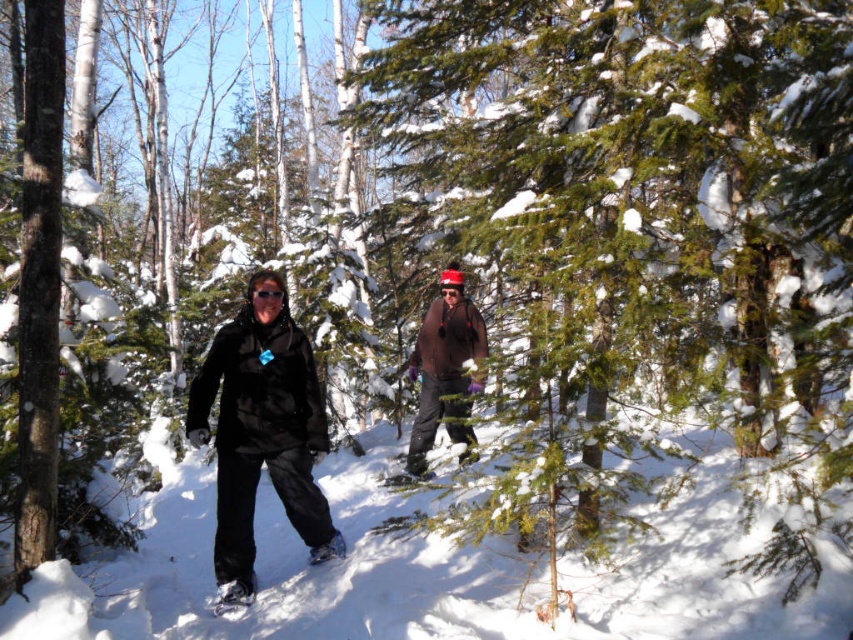
Question: Is black matte snowshoes at center smaller than brown matte jacket at center?

Choices:
 (A) yes
 (B) no

Answer: (A)

Question: Does black matte snowshoes at center have a smaller size compared to white rubber snowshoe at lower left?

Choices:
 (A) no
 (B) yes

Answer: (A)

Question: Which object is closer to the camera taking this photo?

Choices:
 (A) black matte snowshoes at center
 (B) white rubber snowshoe at lower left
 (C) black rubber snowshoe at lower center
 (D) brown matte jacket at center

Answer: (D)

Question: Is black matte snowshoes at center positioned at the back of brown matte jacket at center?

Choices:
 (A) no
 (B) yes

Answer: (B)

Question: Among these objects, which one is nearest to the camera?

Choices:
 (A) white rubber snowshoe at lower left
 (B) black matte snowshoes at center

Answer: (A)

Question: Which point appears farthest from the camera in this image?

Choices:
 (A) (444, 352)
 (B) (242, 582)
 (C) (253, 422)

Answer: (A)